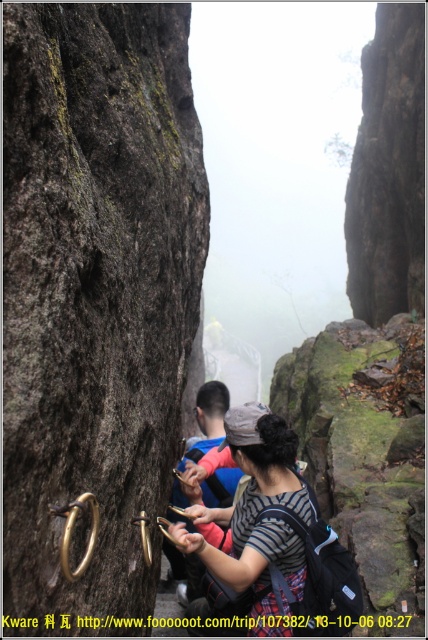
Does point (59, 120) lie in front of point (193, 490)?

That is True.

Can you confirm if gold metallic rings at lower left is smaller than striped fabric shirt at center?

Indeed, gold metallic rings at lower left has a smaller size compared to striped fabric shirt at center.

Between point (110, 161) and point (264, 602), which one is positioned behind?

The point (110, 161) is behind.

Locate an element on the screen. The height and width of the screenshot is (640, 428). gold metallic rings at lower left is located at coordinates (95, 288).

Is gold metallic rings at lower left wider than blue fabric jacket at center?

In fact, gold metallic rings at lower left might be narrower than blue fabric jacket at center.

Who is more distant from viewer, (x=38, y=244) or (x=211, y=413)?

Point (x=211, y=413)

Identify the location of gold metallic rings at lower left. This screenshot has height=640, width=428. (95, 288).

Which is more to the left, striped fabric shirt at center or blue fabric jacket at center?

blue fabric jacket at center

Is striped fabric shirt at center taller than blue fabric jacket at center?

Indeed, striped fabric shirt at center has a greater height compared to blue fabric jacket at center.

Does point (235, 579) lie in front of point (222, 497)?

Yes, it is.

Locate an element on the screen. The height and width of the screenshot is (640, 428). striped fabric shirt at center is located at coordinates (255, 506).